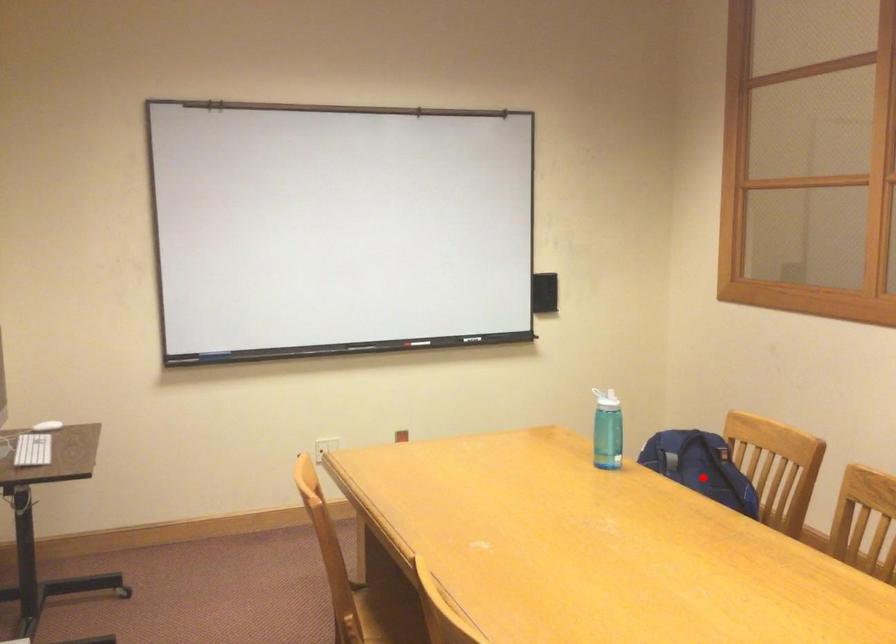
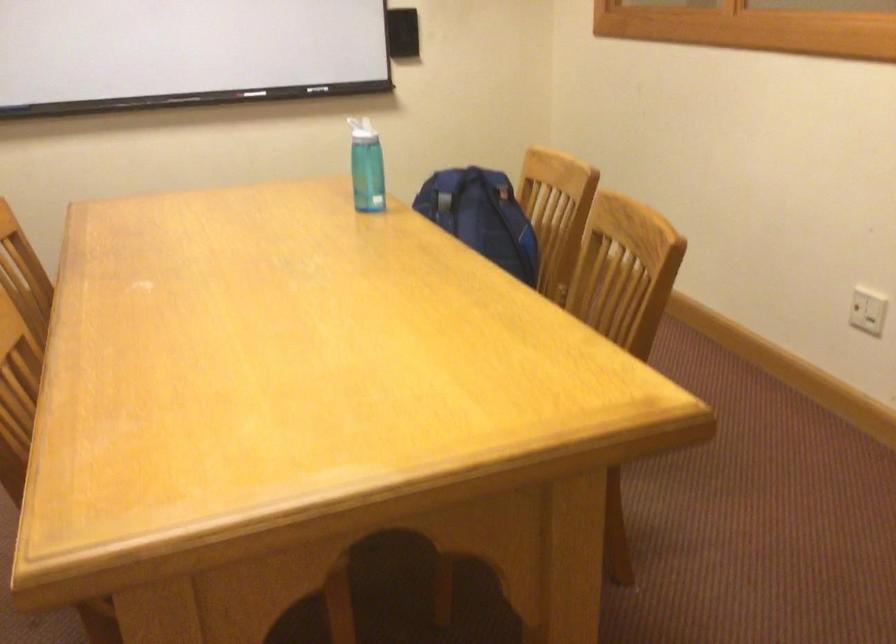
Question: I am providing you with two images of the same scene from different viewpoints. A red point is shown in image1. For the corresponding object point in image2, is it positioned nearer or farther from the camera?

Choices:
 (A) Nearer
 (B) Farther

Answer: (A)